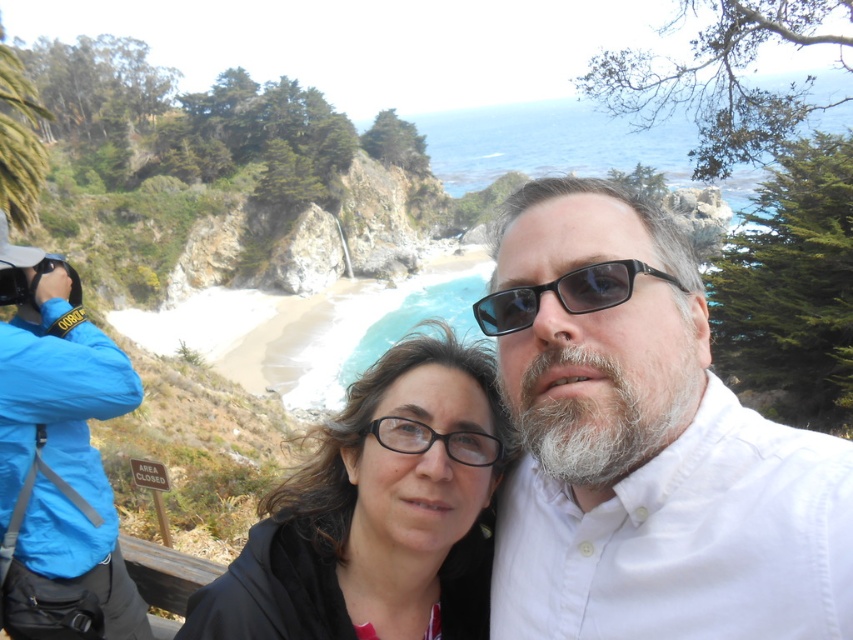
Image resolution: width=853 pixels, height=640 pixels. What are the coordinates of `black matte hair at center` in the screenshot? It's located at (378, 513).

Does black matte hair at center have a greater height compared to black plastic sunglasses at center?

Yes.

Where is `black matte hair at center`? This screenshot has width=853, height=640. black matte hair at center is located at coordinates (378, 513).

Does point (57, 573) lie in front of point (596, 285)?

No.

Does blue fabric jacket at left appear on the right side of black plastic sunglasses at center?

No, blue fabric jacket at left is not to the right of black plastic sunglasses at center.

Is point (26, 448) in front of point (633, 269)?

No, (26, 448) is further to viewer.

Identify the location of blue fabric jacket at left. This screenshot has width=853, height=640. (57, 460).

Between white fuzzy beard at center and black plastic sunglasses at center, which one has less height?

black plastic sunglasses at center

Does white fuzzy beard at center appear under black plastic sunglasses at center?

Yes.

Who is more forward, (670,440) or (490,316)?

Positioned in front is point (670,440).

This screenshot has height=640, width=853. In order to click on white fuzzy beard at center in this screenshot , I will do `click(598, 403)`.